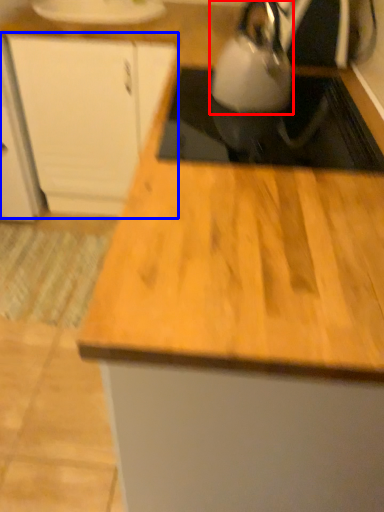
Question: Which object appears closest to the camera in this image, kettle (highlighted by a red box) or cabinetry (highlighted by a blue box)?

Choices:
 (A) kettle
 (B) cabinetry

Answer: (A)